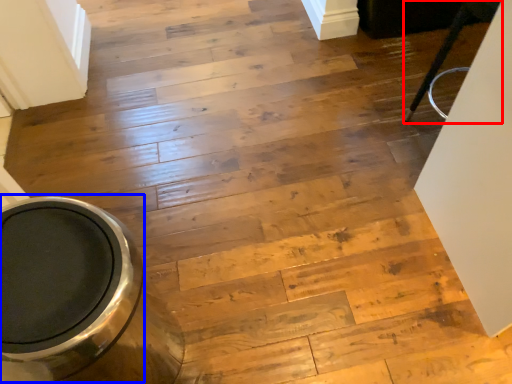
Question: Which of the following is the farthest to the observer, furniture (highlighted by a red box) or toilet bowl (highlighted by a blue box)?

Choices:
 (A) furniture
 (B) toilet bowl

Answer: (A)